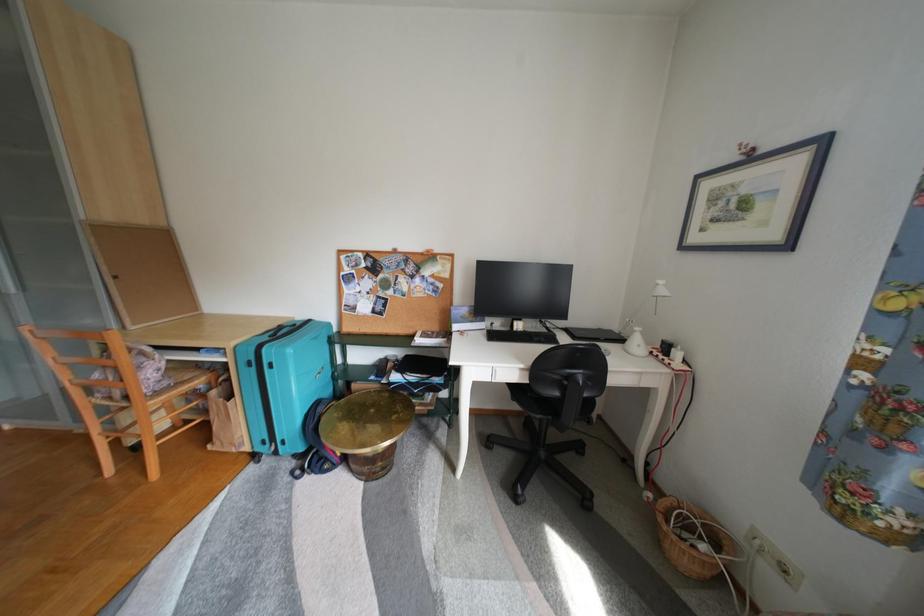
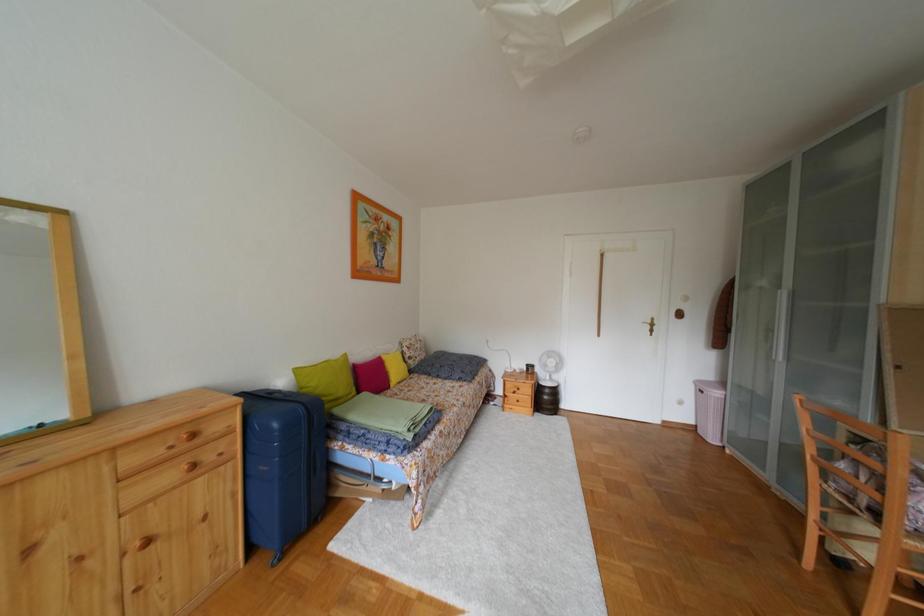
Question: The first image is from the beginning of the video and the second image is from the end. How did the camera likely rotate when shooting the video?

Choices:
 (A) Left
 (B) Right
 (C) Up
 (D) Down

Answer: (A)